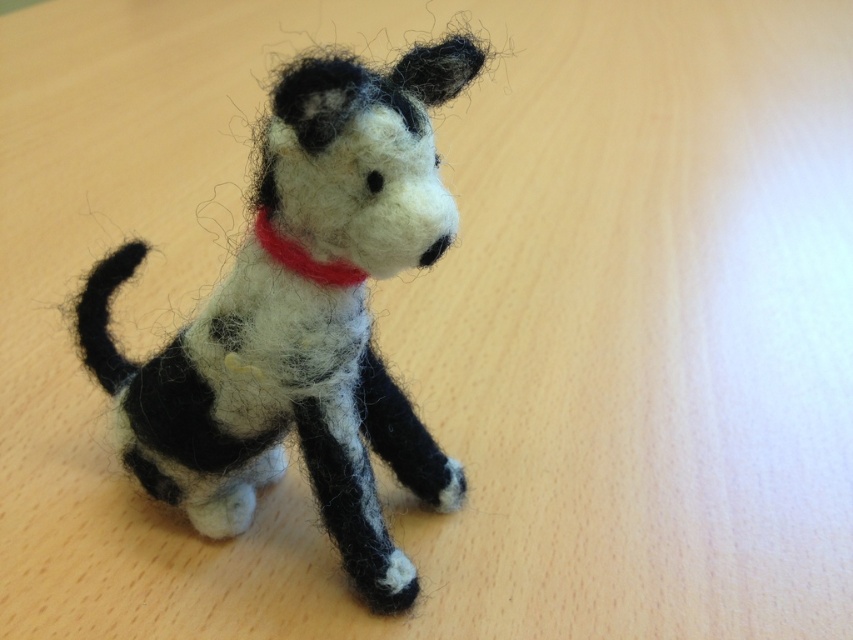
You are an artist observing the image and want to sketch the fuzzy woolen dog at center and the red felt neckband at center. Which object should you draw first if you want to start with the one on the right?

The red felt neckband at center is on the right side of the fuzzy woolen dog at center, so you should start by drawing the red felt neckband at center first.

Based on the photo, you are trying to place a small decorative item on the wooden surface next to the fuzzy woolen dog at center and the red felt neckband at center. Which object should you move if you need more space, considering their widths?

The fuzzy woolen dog at center might be wider than the red felt neckband at center, so moving the fuzzy woolen dog at center would free up more space.

You are holding a ruler and want to measure the distance from your eyes to the point marked as point (421, 230) in the image. What is the approximate distance in inches?

The distance between point (421, 230) and the viewer is 38.63 inches.